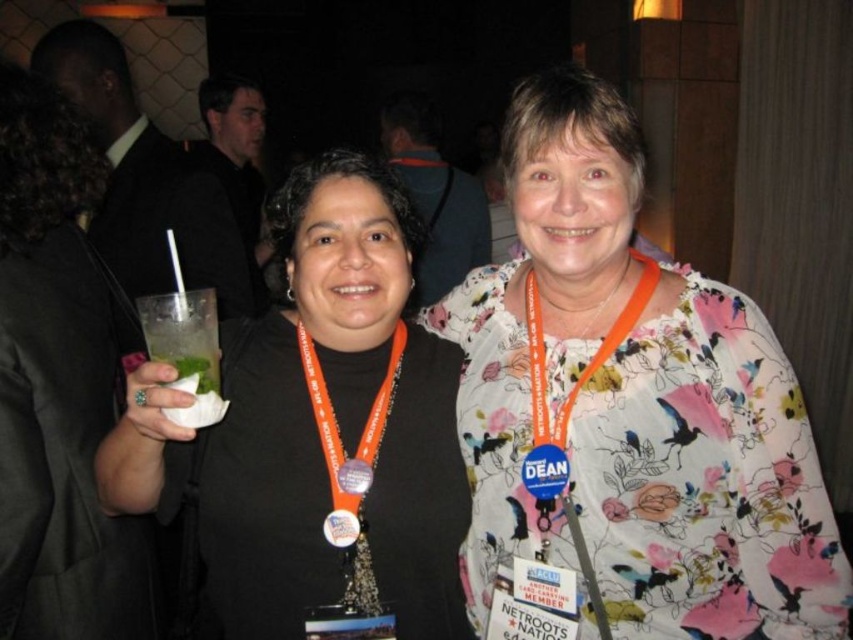
Question: Does floral print blouse at center have a smaller size compared to metallic silver badge at center?

Choices:
 (A) no
 (B) yes

Answer: (A)

Question: Among these points, which one is farthest from the camera?

Choices:
 (A) (544, 460)
 (B) (351, 532)

Answer: (B)

Question: Does matte black shirt at center lie in front of orange plastic badge at center?

Choices:
 (A) yes
 (B) no

Answer: (A)

Question: Among these points, which one is nearest to the camera?

Choices:
 (A) (560, 449)
 (B) (583, 496)
 (C) (339, 476)

Answer: (B)

Question: Does matte black shirt at center appear on the right side of blue fabric badge at center?

Choices:
 (A) no
 (B) yes

Answer: (A)

Question: Based on their relative distances, which object is farther from the orange plastic badge at center?

Choices:
 (A) metallic silver badge at center
 (B) matte black shirt at center

Answer: (B)